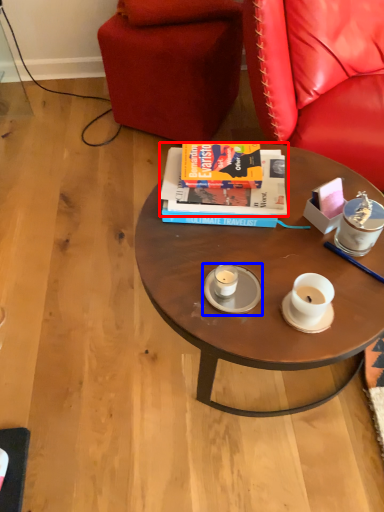
Question: Which object appears farthest to the camera in this image, book (highlighted by a red box) or saucer (highlighted by a blue box)?

Choices:
 (A) book
 (B) saucer

Answer: (A)